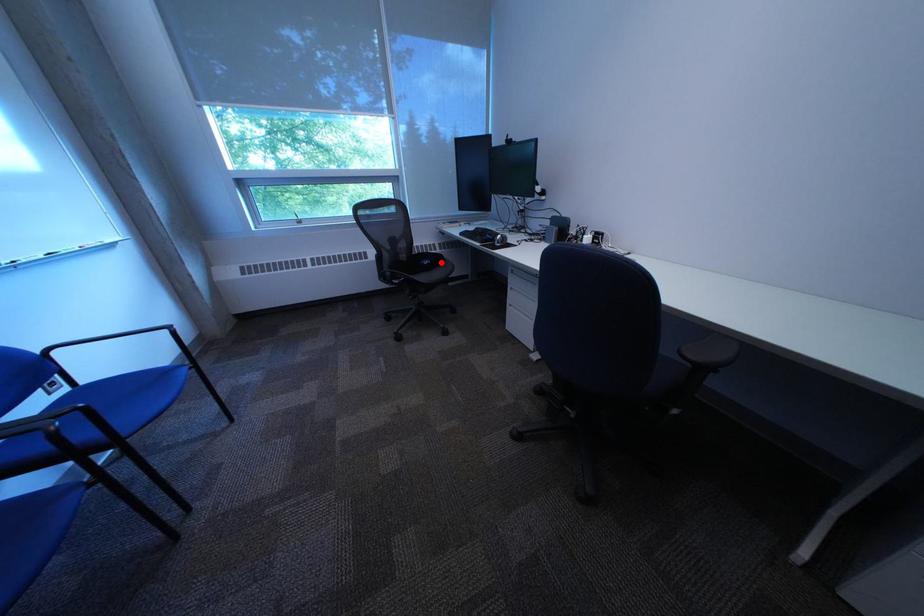
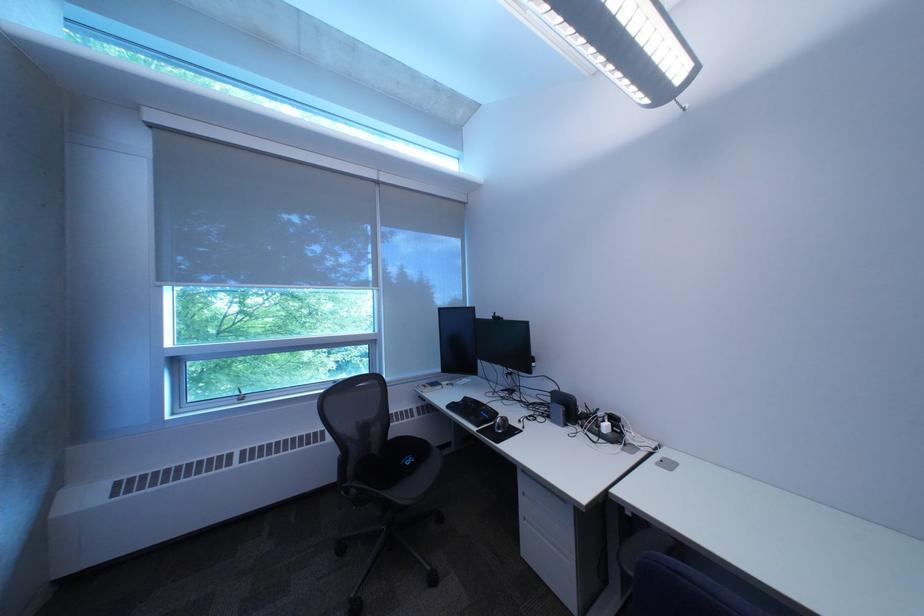
In the second image, find the point that corresponds to the highlighted location in the first image.

(423, 461)